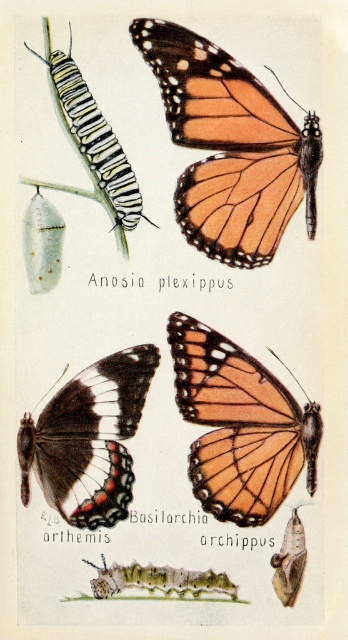
Does orange-patterned wings at center appear over orange matte butterfly at center?

Yes.

This screenshot has height=640, width=348. What do you see at coordinates (231, 147) in the screenshot?
I see `orange-patterned wings at center` at bounding box center [231, 147].

Locate an element on the screen. orange-patterned wings at center is located at coordinates (231, 147).

Who is more forward, (146,19) or (58,65)?

Positioned in front is point (146,19).

The image size is (348, 640). What do you see at coordinates (231, 147) in the screenshot?
I see `orange-patterned wings at center` at bounding box center [231, 147].

Describe the element at coordinates (231, 147) in the screenshot. I see `orange-patterned wings at center` at that location.

Locate an element on the screen. orange-patterned wings at center is located at coordinates (231, 147).

Measure the distance from orange-patterned wings at center to black velvet butterfly at lower left.

orange-patterned wings at center and black velvet butterfly at lower left are 11.81 inches apart from each other.

Can you confirm if orange-patterned wings at center is wider than black velvet butterfly at lower left?

Yes.

Between point (170, 102) and point (57, 492), which one is positioned in front?

Point (57, 492)

This screenshot has width=348, height=640. What are the coordinates of `orange-patterned wings at center` in the screenshot? It's located at (231, 147).